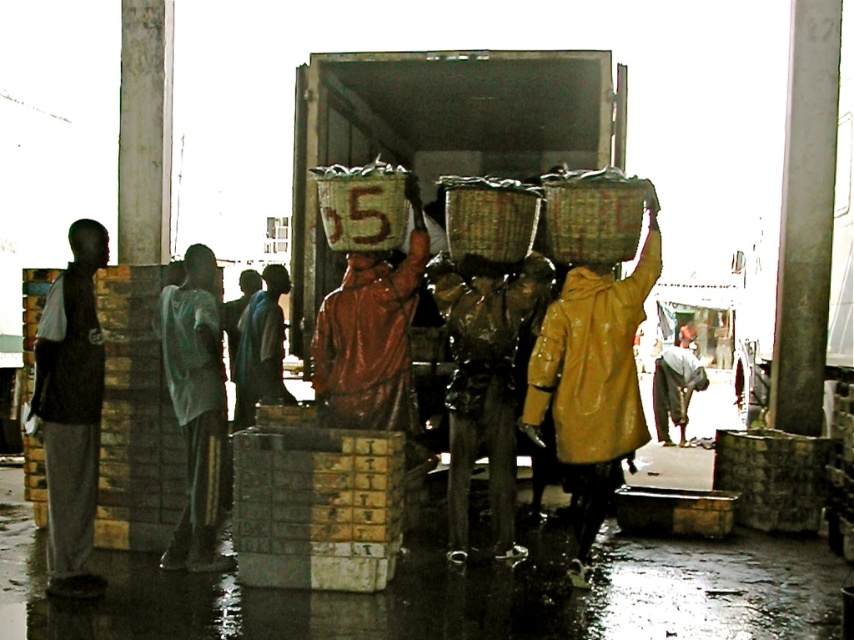
You are a photographer trying to capture both the shiny plastic head at center and the matte brown head at center in the same frame. Based on their positions, which one would appear closer to the camera in your photo?

The shiny plastic head at center appears closer to the camera because it is positioned in front of the matte brown head at center.

You are a delivery person who needs to place a package between the dark gray pants at left and the smooth gray head at center. The package requires a space of 3.5 feet. Can you fit it there?

The dark gray pants at left is 4.02 feet away from the smooth gray head at center. Since the required space is 3.5 feet, the package can fit between them as the distance is sufficient.

You are a safety inspector at the market. You notice two protective items in the center area. Which one is positioned to the right of the other? The items are the shiny plastic head at center and the shiny orange helmet at center.

The shiny plastic head at center is positioned to the right of the shiny orange helmet at center.